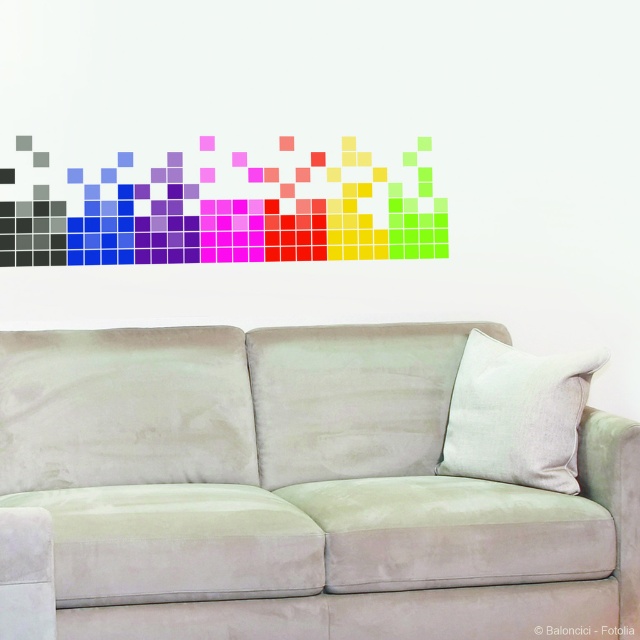
Who is lower down, suede couch at center or matte black pixel art at upper left?

suede couch at center is lower down.

Can you confirm if suede couch at center is smaller than matte black pixel art at upper left?

Incorrect, suede couch at center is not smaller in size than matte black pixel art at upper left.

Locate an element on the screen. The image size is (640, 640). suede couch at center is located at coordinates (292, 492).

Find the location of a particular element. Image resolution: width=640 pixels, height=640 pixels. suede couch at center is located at coordinates (292, 492).

Does point (129, 156) come behind point (515, 456)?

Yes, point (129, 156) is farther from viewer.

Is matte black pixel art at upper left thinner than white linen pillow at center?

Incorrect, matte black pixel art at upper left's width is not less than white linen pillow at center's.

The image size is (640, 640). Find the location of `matte black pixel art at upper left`. matte black pixel art at upper left is located at coordinates (227, 218).

Between suede couch at center and white linen pillow at center, which one has more height?

With more height is suede couch at center.

Which is in front, point (531, 589) or point (476, 408)?

Point (531, 589) is more forward.

The image size is (640, 640). Find the location of `suede couch at center`. suede couch at center is located at coordinates (292, 492).